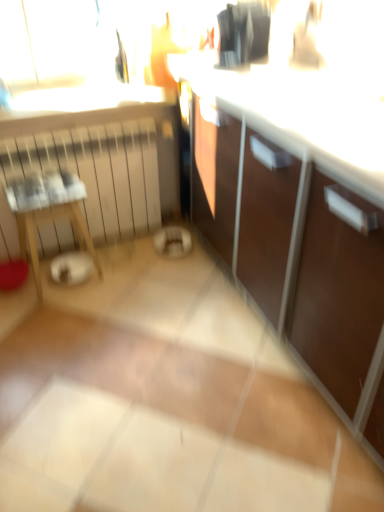
Image resolution: width=384 pixels, height=512 pixels. What do you see at coordinates (48, 212) in the screenshot? I see `wooden table at left` at bounding box center [48, 212].

The height and width of the screenshot is (512, 384). Find the location of `black glossy coffee maker at upper center`. black glossy coffee maker at upper center is located at coordinates (243, 34).

This screenshot has height=512, width=384. Find the location of `wooden table at left`. wooden table at left is located at coordinates (48, 212).

Is black glossy coffee maker at upper center oriented away from wooden table at left?

No, black glossy coffee maker at upper center is not facing away from wooden table at left.

Is the position of black glossy coffee maker at upper center less distant than that of wooden table at left?

Yes, it is in front of wooden table at left.

From a real-world perspective, who is located lower, black glossy coffee maker at upper center or wooden table at left?

In real-world perspective, wooden table at left is lower.

Considering the sizes of objects black glossy coffee maker at upper center and white matte radiator at left in the image provided, who is thinner, black glossy coffee maker at upper center or white matte radiator at left?

white matte radiator at left is thinner.

Find the location of `appliance in front of the white matte radiator at left`. appliance in front of the white matte radiator at left is located at coordinates (243, 34).

Which object is more forward, black glossy coffee maker at upper center or white matte radiator at left?

Positioned in front is black glossy coffee maker at upper center.

Is black glossy coffee maker at upper center turned away from white matte radiator at left?

No, black glossy coffee maker at upper center is not facing the opposite direction of white matte radiator at left.

Which is in front, point (61, 211) or point (147, 152)?

The point (61, 211) is in front.

In the scene shown: From the image's perspective, between wooden table at left and white matte radiator at left, who is located below?

wooden table at left appears lower in the image.

Which object is positioned more to the right, wooden table at left or white matte radiator at left?

Positioned to the right is white matte radiator at left.

Is wooden table at left with white matte radiator at left?

No, wooden table at left is not in contact with white matte radiator at left.

From the image's perspective, which is below, white matte radiator at left or clear glass window sill at upper center?

From the image's view, white matte radiator at left is below.

Considering the positions of point (55, 241) and point (50, 101), is point (55, 241) closer or farther from the camera than point (50, 101)?

Point (55, 241) is farther from the camera than point (50, 101).

From the picture: Does white matte radiator at left have a smaller size compared to clear glass window sill at upper center?

Incorrect, white matte radiator at left is not smaller in size than clear glass window sill at upper center.

Is white matte radiator at left facing towards clear glass window sill at upper center?

No, white matte radiator at left does not turn towards clear glass window sill at upper center.

Does clear glass window sill at upper center turn towards black glossy coffee maker at upper center?

No, clear glass window sill at upper center is not aimed at black glossy coffee maker at upper center.

Considering the relative sizes of clear glass window sill at upper center and black glossy coffee maker at upper center in the image provided, is clear glass window sill at upper center smaller than black glossy coffee maker at upper center?

Actually, clear glass window sill at upper center might be larger than black glossy coffee maker at upper center.

From the image's perspective, does clear glass window sill at upper center appear lower than black glossy coffee maker at upper center?

Yes.

From the image's perspective, who appears lower, clear glass window sill at upper center or white matte radiator at left?

white matte radiator at left, from the image's perspective.

Who is shorter, clear glass window sill at upper center or white matte radiator at left?

clear glass window sill at upper center is shorter.

How distant is clear glass window sill at upper center from white matte radiator at left?

A distance of 32.68 centimeters exists between clear glass window sill at upper center and white matte radiator at left.

Find the location of a particular element. The height and width of the screenshot is (512, 384). radiator located in front of the clear glass window sill at upper center is located at coordinates (98, 170).

Between clear glass window sill at upper center and wooden table at left, which one has smaller size?

clear glass window sill at upper center is smaller.

Is clear glass window sill at upper center oriented towards wooden table at left?

No, clear glass window sill at upper center is not oriented towards wooden table at left.

Is clear glass window sill at upper center inside the boundaries of wooden table at left, or outside?

The correct answer is: outside.

In the image, there is a wooden table at left. Identify the location of appliance above it (from the image's perspective). The image size is (384, 512). (243, 34).

Find the location of a particular element. This screenshot has width=384, height=512. radiator below the black glossy coffee maker at upper center (from a real-world perspective) is located at coordinates (98, 170).

Looking at the image, which one is located further to wooden table at left, clear glass window sill at upper center or white matte radiator at left?

clear glass window sill at upper center.

Considering their positions, is clear glass window sill at upper center positioned further to black glossy coffee maker at upper center than wooden table at left?

Among the two, wooden table at left is located further to black glossy coffee maker at upper center.

Based on their spatial positions, is wooden table at left or black glossy coffee maker at upper center further from white matte radiator at left?

black glossy coffee maker at upper center is positioned further to the anchor white matte radiator at left.

Based on their spatial positions, is black glossy coffee maker at upper center or wooden table at left further from white matte radiator at left?

black glossy coffee maker at upper center.

Which object lies nearer to the anchor point black glossy coffee maker at upper center, white matte radiator at left or wooden table at left?

white matte radiator at left lies closer to black glossy coffee maker at upper center than the other object.

When comparing their distances from wooden table at left, does white matte radiator at left or black glossy coffee maker at upper center seem further?

Among the two, black glossy coffee maker at upper center is located further to wooden table at left.

Looking at the image, which one is located further to clear glass window sill at upper center, white matte radiator at left or wooden table at left?

wooden table at left is further to clear glass window sill at upper center.

Estimate the real-world distances between objects in this image. Which object is further from clear glass window sill at upper center, black glossy coffee maker at upper center or wooden table at left?

Among the two, black glossy coffee maker at upper center is located further to clear glass window sill at upper center.

At what (x,y) coordinates should I click in order to perform the action: click on radiator between wooden table at left and black glossy coffee maker at upper center from left to right. Please return your answer as a coordinate pair (x, y). Looking at the image, I should click on (98, 170).

At what (x,y) coordinates should I click in order to perform the action: click on window sill between white matte radiator at left and black glossy coffee maker at upper center in the horizontal direction. Please return your answer as a coordinate pair (x, y). Looking at the image, I should click on (88, 98).

The width and height of the screenshot is (384, 512). In order to click on radiator between clear glass window sill at upper center and wooden table at left in the up-down direction in this screenshot , I will do `click(98, 170)`.

Locate an element on the screen. The height and width of the screenshot is (512, 384). window sill between wooden table at left and black glossy coffee maker at upper center from left to right is located at coordinates (88, 98).